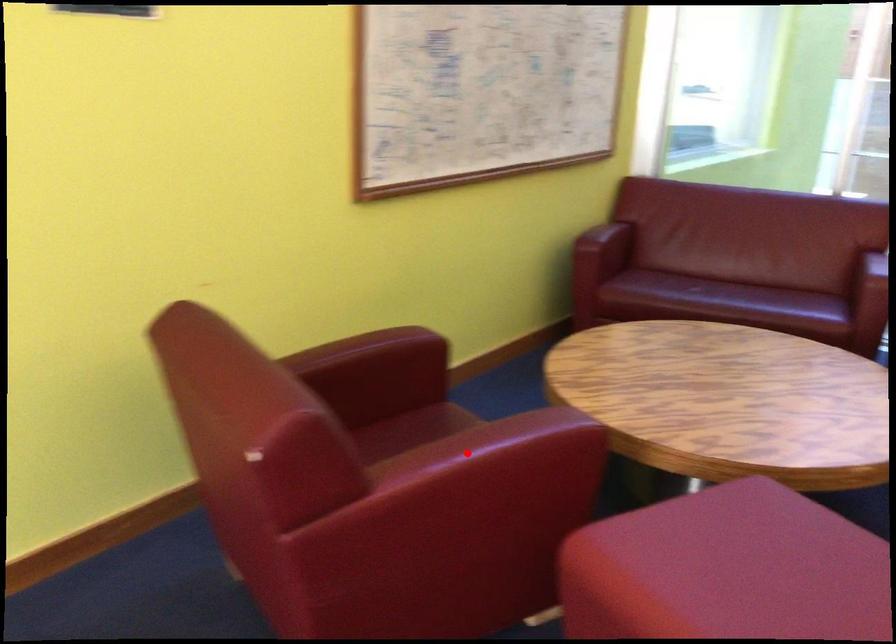
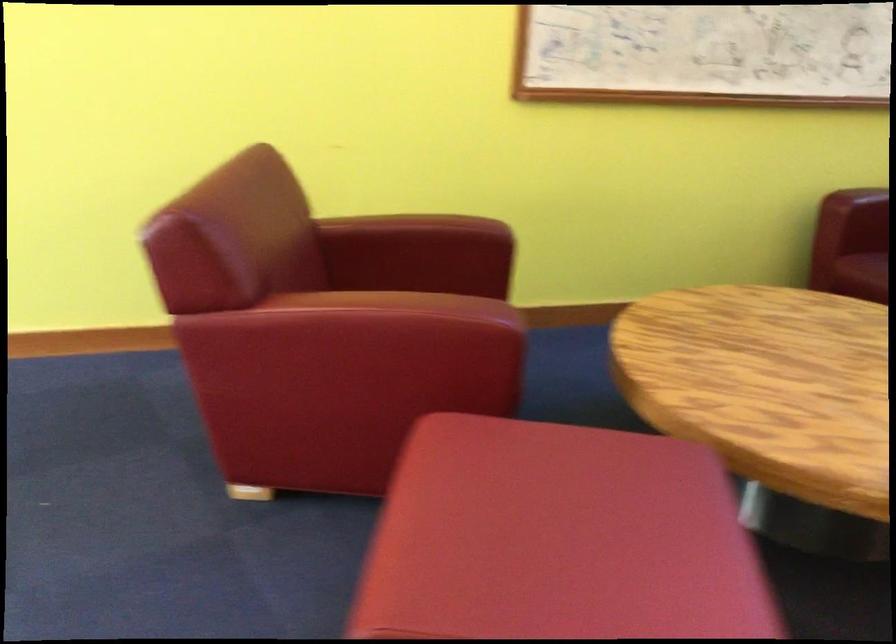
Find the pixel in the second image that matches the highlighted location in the first image.

(356, 301)